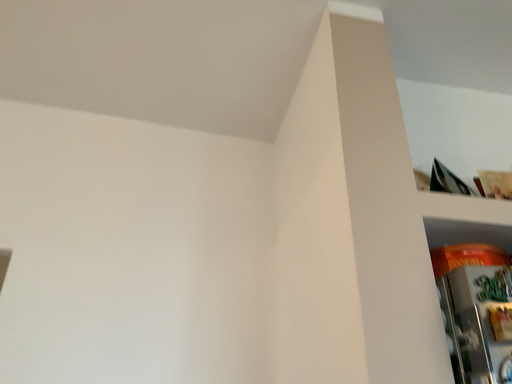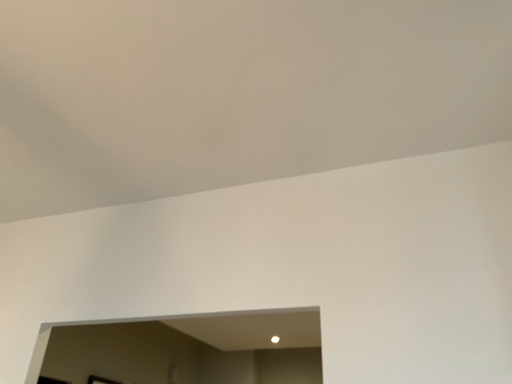
Question: How did the camera likely rotate when shooting the video?

Choices:
 (A) rotated right
 (B) rotated left

Answer: (B)